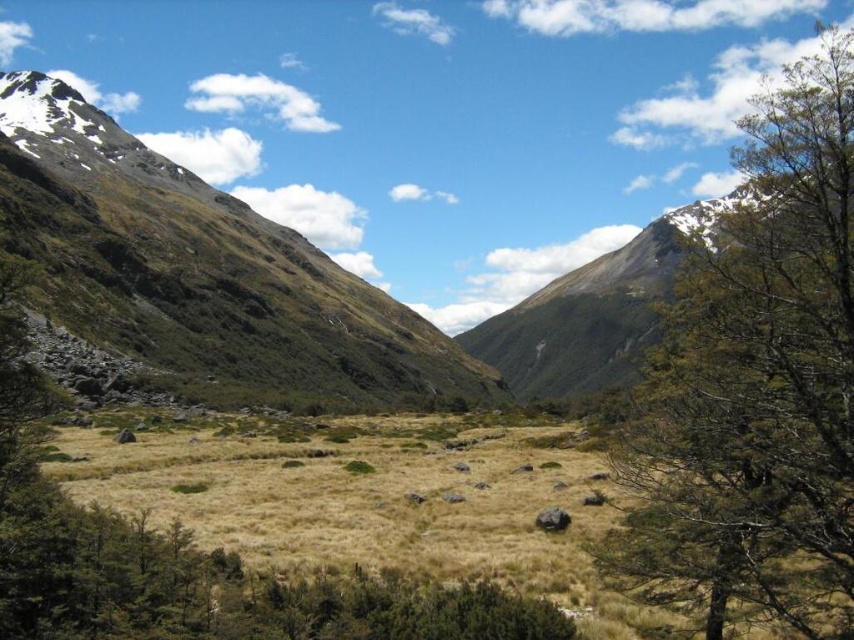
I want to click on green leafy tree at right, so tap(758, 380).

Does green leafy tree at right have a lesser height compared to brown rocky mountain at center?

Yes, green leafy tree at right is shorter than brown rocky mountain at center.

Where is `green leafy tree at right`? green leafy tree at right is located at coordinates (758, 380).

Identify the location of green leafy tree at right. (758, 380).

Locate an element on the screen. green leafy tree at right is located at coordinates (758, 380).

Can you confirm if green leafy tree at right is positioned to the right of green grassy mountain at center?

Yes, green leafy tree at right is to the right of green grassy mountain at center.

Does point (688, 554) come closer to viewer compared to point (613, 300)?

Yes.

This screenshot has height=640, width=854. In order to click on green leafy tree at right in this screenshot , I will do `click(758, 380)`.

Is brown rocky mountain at center to the right of green grassy mountain at center from the viewer's perspective?

No, brown rocky mountain at center is not to the right of green grassy mountain at center.

This screenshot has width=854, height=640. What are the coordinates of `brown rocky mountain at center` in the screenshot? It's located at (202, 268).

You are a GUI agent. You are given a task and a screenshot of the screen. Output one action in this format:
    pyautogui.click(x=<x>, y=<y>)
    Task: Click on the brown rocky mountain at center
    This screenshot has height=640, width=854.
    Given the screenshot: What is the action you would take?
    pyautogui.click(x=202, y=268)